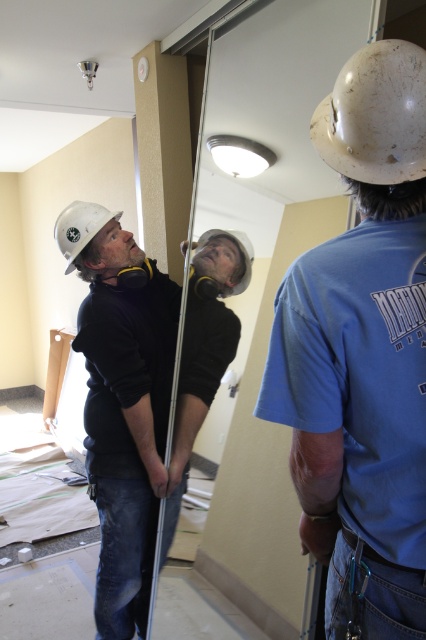
You are a construction worker standing at the origin point in the center of the room. You need to place a new tool at the location where the matte black helmet at center is currently located. What coordinates should you aim for to place the tool exactly where the matte black helmet is?

The coordinates for the matte black helmet at center are at point [141,392]. So you should aim for those coordinates to place the tool exactly where the matte black helmet is.

You are standing in a construction site and see a point at coordinates (x=80, y=227). What object is located at that point?

The point at coordinates (x=80, y=227) corresponds to the white matte helmet at upper left.